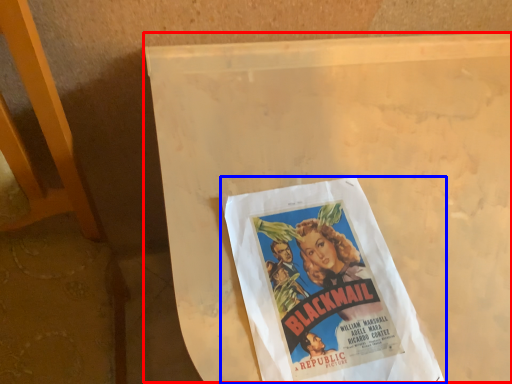
Question: Which of the following is the closest to the observer, table (highlighted by a red box) or poster (highlighted by a blue box)?

Choices:
 (A) table
 (B) poster

Answer: (A)